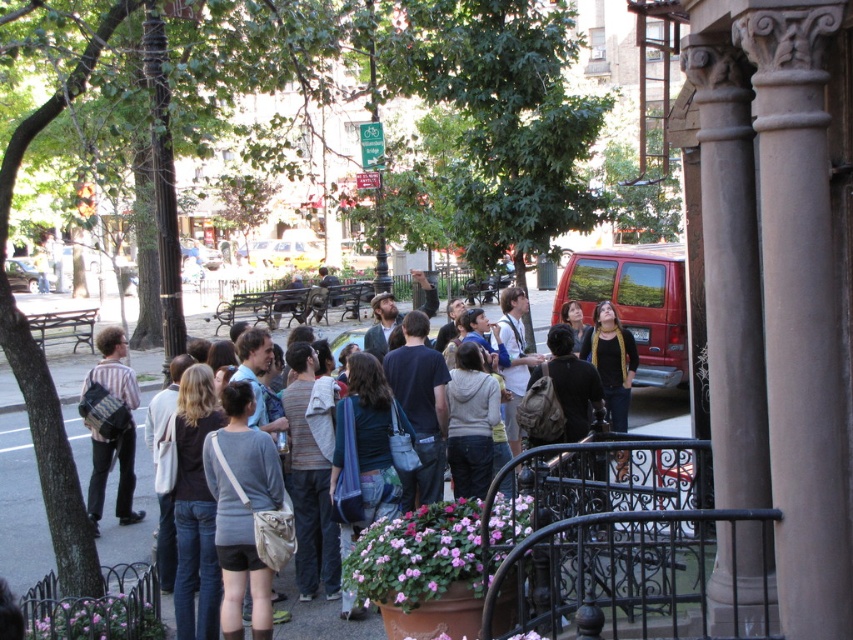
Question: Estimate the real-world distances between objects in this image. Which object is closer to the smooth stone column at right?

Choices:
 (A) matte gray backpack at center
 (B) striped cotton shirt at center

Answer: (B)

Question: Which of these objects is positioned closest to the striped cotton shirt at center?

Choices:
 (A) matte gray backpack at center
 (B) smooth stone column at right

Answer: (A)

Question: Is the position of matte gray backpack at center less distant than that of striped cotton shirt at center?

Choices:
 (A) yes
 (B) no

Answer: (A)

Question: In this image, where is matte gray backpack at center located relative to striped cotton shirt at center?

Choices:
 (A) right
 (B) left

Answer: (A)

Question: Which point appears closest to the camera in this image?

Choices:
 (A) (740, 598)
 (B) (287, 628)
 (C) (106, 376)

Answer: (A)

Question: Can you confirm if smooth stone column at right is thinner than matte gray backpack at center?

Choices:
 (A) yes
 (B) no

Answer: (A)